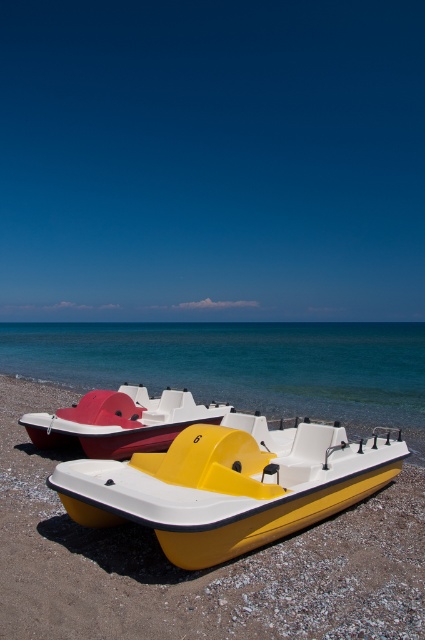
I want to click on yellow matte pedal boat at center, so click(x=226, y=486).

Which is behind, point (88, 502) or point (175, 401)?

Positioned behind is point (175, 401).

Where is `yellow matte pedal boat at center`? yellow matte pedal boat at center is located at coordinates (226, 486).

Which is behind, point (342, 419) or point (200, 442)?

Positioned behind is point (342, 419).

Looking at this image, is blue water at center bigger than yellow matte pedal boat at center?

Yes.

Who is more distant from viewer, (359, 387) or (303, 483)?

Point (359, 387)

Find the location of `blue water at center`. blue water at center is located at coordinates (x=237, y=364).

How distant is blue water at center from matte plastic paddle boat at lower left?

They are 22.63 meters apart.

Consider the image. Between blue water at center and matte plastic paddle boat at lower left, which one is positioned higher?

Positioned higher is blue water at center.

Between point (339, 362) and point (67, 435), which one is positioned in front?

Positioned in front is point (67, 435).

Identify the location of blue water at center. The height and width of the screenshot is (640, 425). (237, 364).